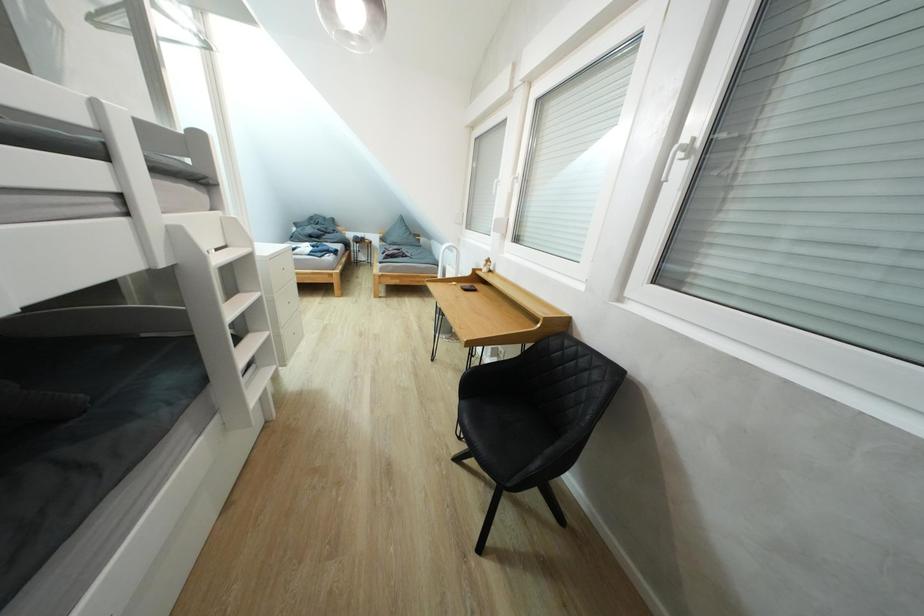
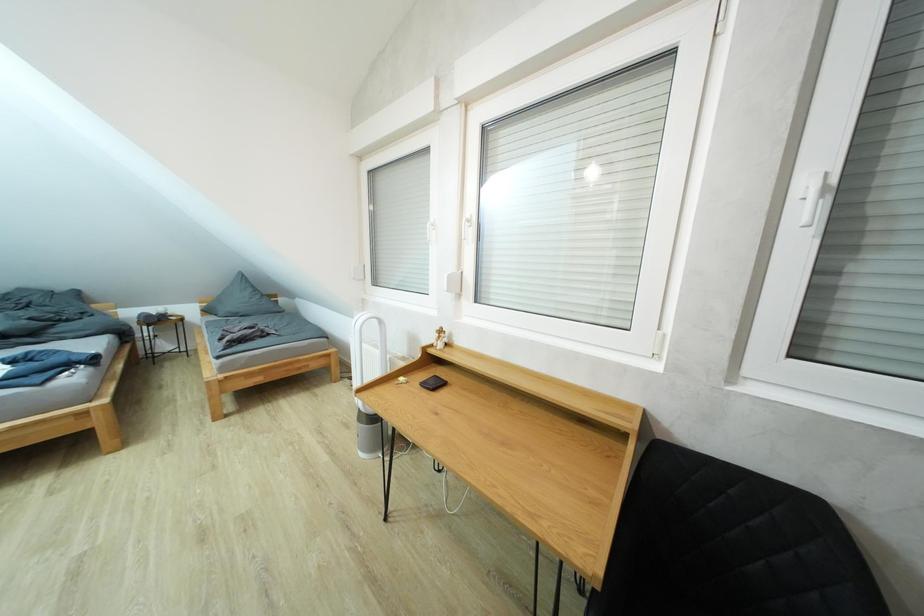
Question: How did the camera likely rotate?

Choices:
 (A) Left
 (B) Right
 (C) Up
 (D) Down

Answer: (B)